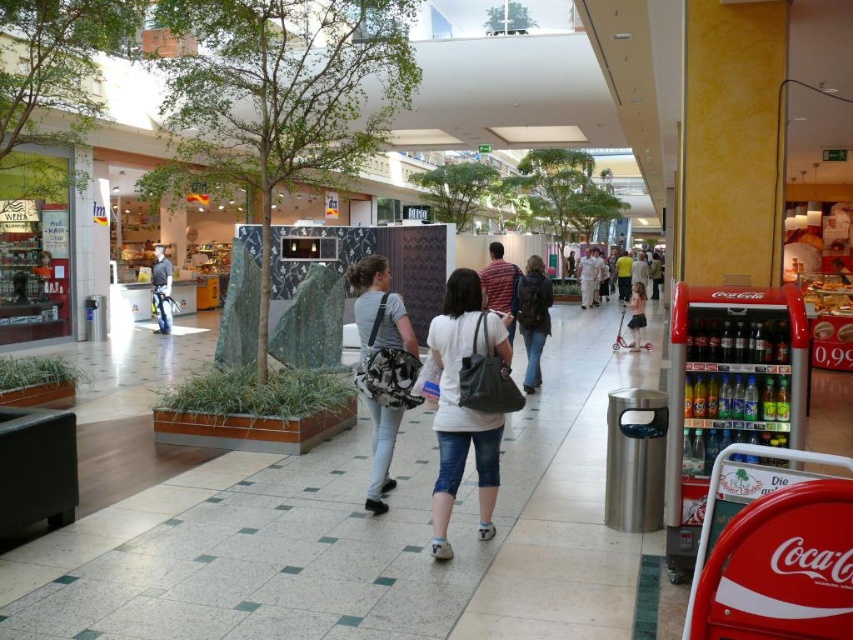
Is white matte backpack at center wider than denim jacket at center?

Indeed, white matte backpack at center has a greater width compared to denim jacket at center.

The height and width of the screenshot is (640, 853). What do you see at coordinates (463, 406) in the screenshot? I see `white matte backpack at center` at bounding box center [463, 406].

This screenshot has width=853, height=640. I want to click on white matte backpack at center, so click(463, 406).

Does point (581, 547) come in front of point (634, 294)?

That is True.

In the scene shown: Who is more distant from viewer, (410, 541) or (640, 310)?

Point (640, 310)

Which is behind, point (149, 512) or point (635, 333)?

The point (635, 333) is more distant.

You are a GUI agent. You are given a task and a screenshot of the screen. Output one action in this format:
    pyautogui.click(x=<x>, y=<y>)
    Task: Click on the white tile pavement at center
    This screenshot has width=853, height=640.
    Given the screenshot: What is the action you would take?
    pyautogui.click(x=360, y=536)

Does white matte backpack at center have a lesser width compared to pink satin dress at center?

Yes.

Is white matte backpack at center in front of pink satin dress at center?

Yes, it is.

Looking at this image, measure the distance between white matte backpack at center and camera.

The distance of white matte backpack at center from camera is 12.79 feet.

Find the location of a particular element. white matte backpack at center is located at coordinates (463, 406).